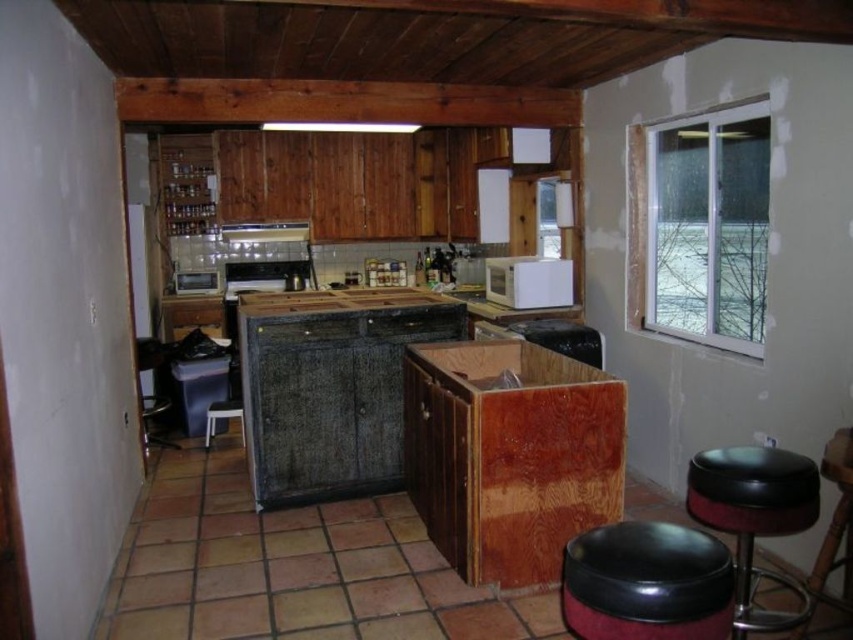
Question: Which of the following is the closest to the observer?

Choices:
 (A) white matte microwave at center
 (B) wooden at center
 (C) metallic silver exhaust hood at upper center

Answer: (B)

Question: Can you confirm if wooden at center is smaller than metallic silver exhaust hood at upper center?

Choices:
 (A) yes
 (B) no

Answer: (B)

Question: Which point is farther to the camera?

Choices:
 (A) (257, 225)
 (B) (335, 298)

Answer: (A)

Question: Does black leather stool at lower right appear under white matte microwave at center?

Choices:
 (A) no
 (B) yes

Answer: (B)

Question: Is black leather bar stool at lower right further to the viewer compared to white matte microwave at center?

Choices:
 (A) yes
 (B) no

Answer: (B)

Question: Which of the following is the farthest from the observer?

Choices:
 (A) white plastic stool at center
 (B) black leather bar stool at lower right
 (C) black leather stool at lower right

Answer: (A)